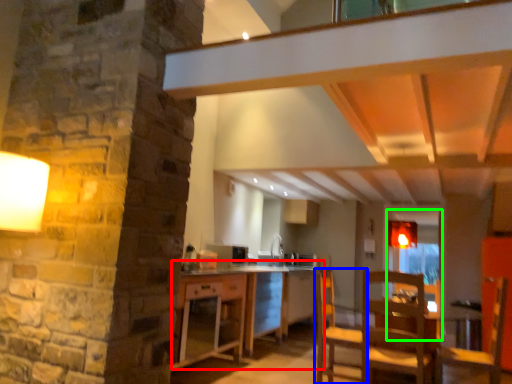
Question: Considering the real-world distances, which object is farthest from table (highlighted by a red box)? chair (highlighted by a blue box) or glass door (highlighted by a green box)?

Choices:
 (A) chair
 (B) glass door

Answer: (B)